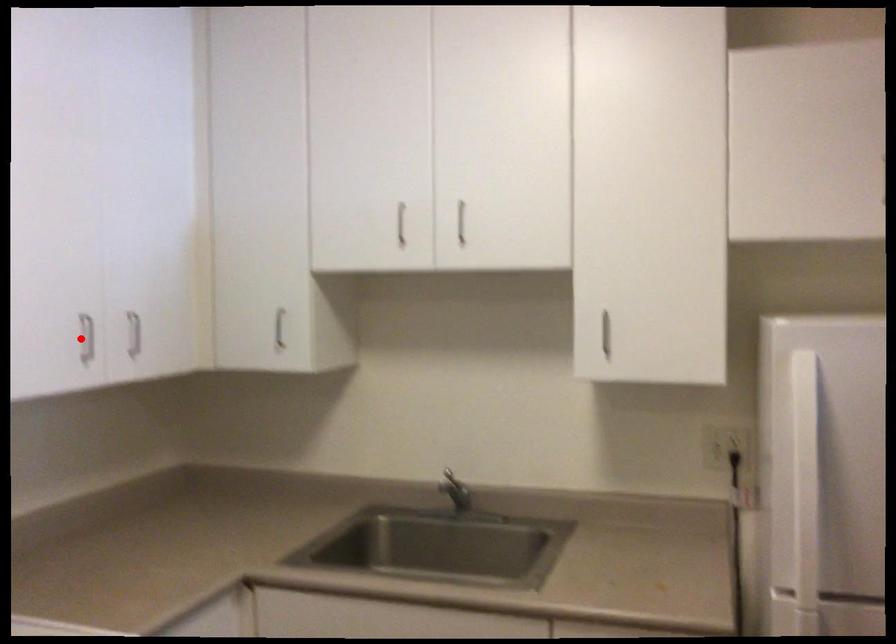
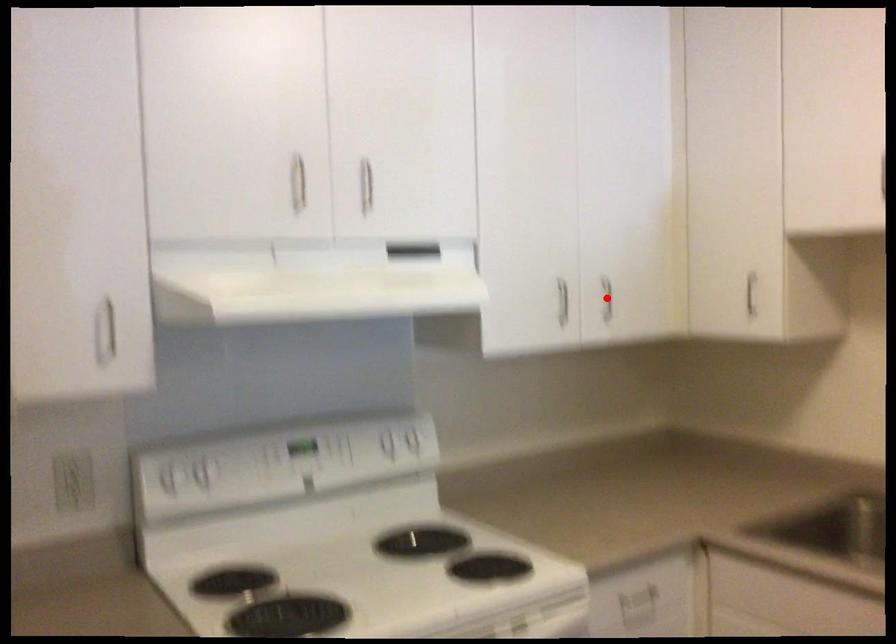
I am providing you with two images of the same scene from different viewpoints. A red point is marked on the first image and another point is marked on the second image. Is the marked point in image1 the same physical position as the marked point in image2?

No